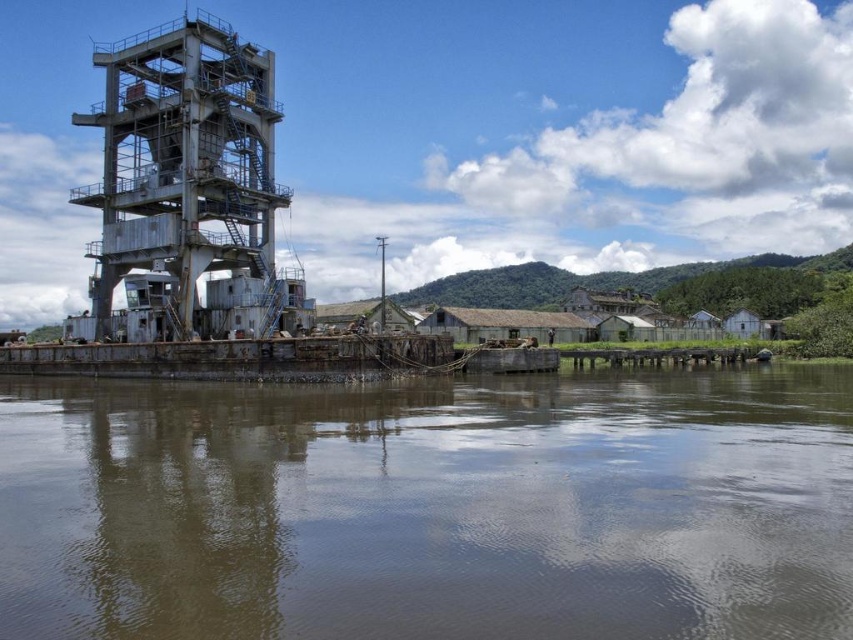
Who is lower down, brown murky water at lower center or rusty metal tower at left?

brown murky water at lower center

Who is more forward, (x=648, y=488) or (x=157, y=152)?

Point (x=648, y=488) is more forward.

What are the coordinates of `brown murky water at lower center` in the screenshot? It's located at (430, 508).